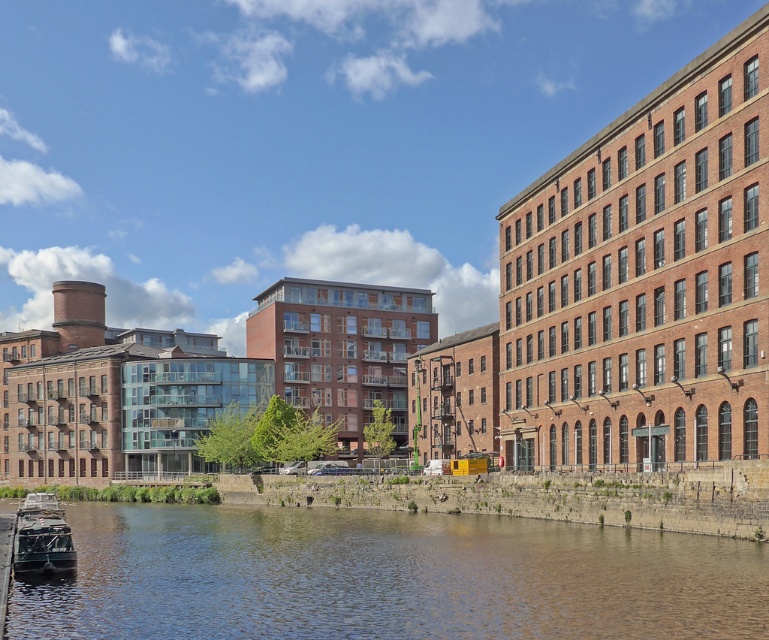
Measure the distance from brown stone river at lower left to metallic gray boat at lower left.

47.10 feet

Who is more distant from viewer, [161,524] or [38,560]?

Point [161,524]

The height and width of the screenshot is (640, 769). What are the coordinates of `brown stone river at lower left` in the screenshot? It's located at (385, 577).